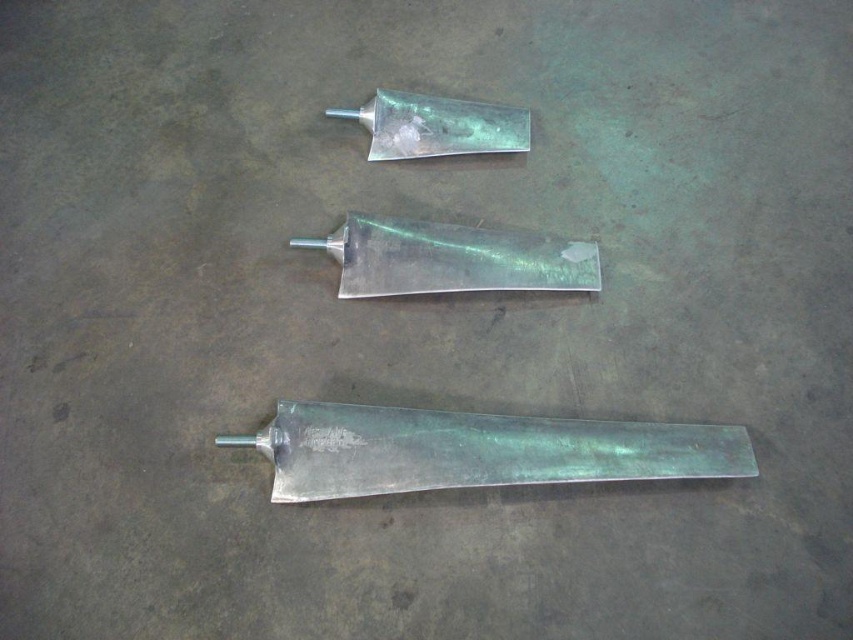
Does metallic silver razor at bottom have a smaller size compared to shiny silver razor at center?

No, metallic silver razor at bottom is not smaller than shiny silver razor at center.

The image size is (853, 640). What do you see at coordinates (476, 451) in the screenshot?
I see `metallic silver razor at bottom` at bounding box center [476, 451].

Which is behind, point (283, 401) or point (393, 112)?

The point (393, 112) is behind.

Find the location of a particular element. This screenshot has height=640, width=853. metallic silver razor at bottom is located at coordinates (476, 451).

Based on the photo, measure the distance between metallic silver razor at center and camera.

metallic silver razor at center is 1.46 meters away from camera.

Does metallic silver razor at center have a greater height compared to shiny silver razor at center?

Correct, metallic silver razor at center is much taller as shiny silver razor at center.

Who is more forward, (460, 280) or (376, 125)?

Point (460, 280) is more forward.

Find the location of a particular element. This screenshot has width=853, height=640. metallic silver razor at center is located at coordinates pos(451,259).

Is point (474, 474) positioned behind point (403, 250)?

No, (474, 474) is closer to viewer.

Is metallic silver razor at bottom to the left of metallic silver razor at center from the viewer's perspective?

No, metallic silver razor at bottom is not to the left of metallic silver razor at center.

Between point (277, 406) and point (505, 253), which one is positioned in front?

Point (277, 406) is more forward.

What are the coordinates of `metallic silver razor at bottom` in the screenshot? It's located at (476, 451).